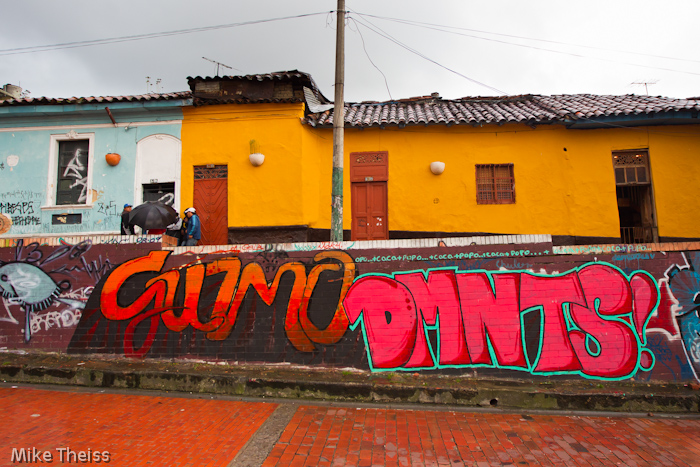
Where is `windows`? This screenshot has height=467, width=700. windows is located at coordinates (490, 181), (83, 174).